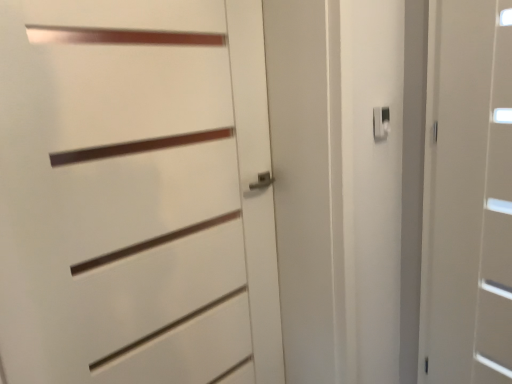
Question: Is white plastic latch at upper right wider than white matte door at right, placed as the first door when sorted from right to left?

Choices:
 (A) no
 (B) yes

Answer: (A)

Question: From the image's perspective, would you say white plastic latch at upper right is shown under white matte door at right, which ranks as the 2th door in left-to-right order?

Choices:
 (A) no
 (B) yes

Answer: (A)

Question: From the image's perspective, is white plastic latch at upper right above white matte door at right, which ranks as the 2th door in left-to-right order?

Choices:
 (A) no
 (B) yes

Answer: (B)

Question: Considering the relative sizes of white plastic latch at upper right and white matte door at right, which ranks as the 2th door in left-to-right order, in the image provided, is white plastic latch at upper right shorter than white matte door at right, which ranks as the 2th door in left-to-right order,?

Choices:
 (A) yes
 (B) no

Answer: (A)

Question: Considering the relative sizes of white plastic latch at upper right and white matte door at right, which ranks as the 2th door in left-to-right order, in the image provided, is white plastic latch at upper right thinner than white matte door at right, which ranks as the 2th door in left-to-right order,?

Choices:
 (A) no
 (B) yes

Answer: (B)

Question: Is white plastic latch at upper right in front of white matte door at right, which ranks as the 2th door in left-to-right order?

Choices:
 (A) yes
 (B) no

Answer: (B)

Question: Could you tell me if white matte door at right, which ranks as the 2th door in left-to-right order, is turned towards white matte door at center, which is counted as the 1th door, starting from the left?

Choices:
 (A) yes
 (B) no

Answer: (A)

Question: Is white matte door at center, which is counted as the 2th door, starting from the right, at the back of white matte door at right, placed as the first door when sorted from right to left?

Choices:
 (A) no
 (B) yes

Answer: (A)

Question: Can you confirm if white matte door at right, which ranks as the 2th door in left-to-right order, is thinner than white matte door at center, which is counted as the 2th door, starting from the right?

Choices:
 (A) no
 (B) yes

Answer: (A)

Question: Considering the relative sizes of white matte door at right, which ranks as the 2th door in left-to-right order, and white matte door at center, which is counted as the 1th door, starting from the left, in the image provided, is white matte door at right, which ranks as the 2th door in left-to-right order, shorter than white matte door at center, which is counted as the 1th door, starting from the left,?

Choices:
 (A) yes
 (B) no

Answer: (B)

Question: Is white matte door at right, which ranks as the 2th door in left-to-right order, with white matte door at center, which is counted as the 2th door, starting from the right?

Choices:
 (A) no
 (B) yes

Answer: (A)

Question: Does white matte door at right, placed as the first door when sorted from right to left, lie behind white matte door at center, which is counted as the 2th door, starting from the right?

Choices:
 (A) yes
 (B) no

Answer: (A)

Question: Can you confirm if white matte door at center, which is counted as the 1th door, starting from the left, is bigger than white plastic latch at upper right?

Choices:
 (A) yes
 (B) no

Answer: (A)